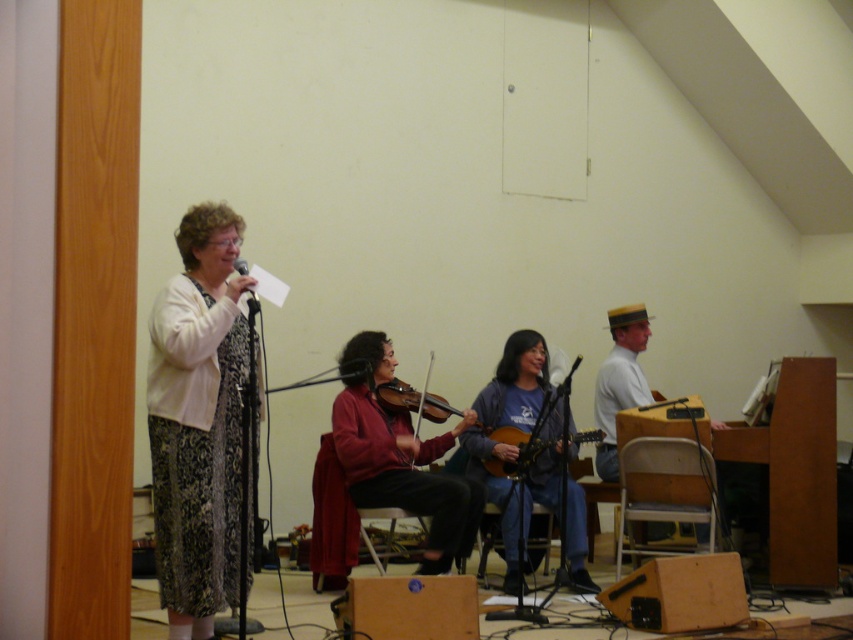
Can you confirm if red knit sweater at center is positioned to the left of black matte microphone at upper left?

No, red knit sweater at center is not to the left of black matte microphone at upper left.

Is red knit sweater at center positioned behind black matte microphone at upper left?

Yes, it is behind black matte microphone at upper left.

Image resolution: width=853 pixels, height=640 pixels. What are the coordinates of `red knit sweater at center` in the screenshot? It's located at (399, 456).

Looking at this image, does red knit sweater at center appear under blue cotton shirt at center?

No, red knit sweater at center is not below blue cotton shirt at center.

Is point (430, 492) behind point (524, 397)?

No, it is in front of (524, 397).

The height and width of the screenshot is (640, 853). I want to click on red knit sweater at center, so click(x=399, y=456).

Can you confirm if patterned fabric dress at left is thinner than wooden violin at center?

Yes, patterned fabric dress at left is thinner than wooden violin at center.

Between point (181, 232) and point (514, 465), which one is positioned behind?

The point (514, 465) is more distant.

Identify the location of patterned fabric dress at left. The height and width of the screenshot is (640, 853). (198, 420).